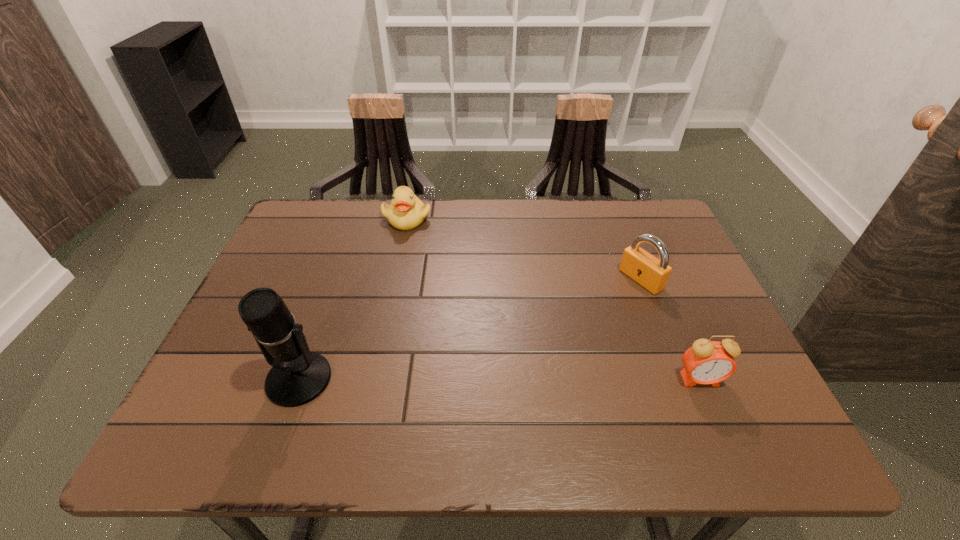
This screenshot has height=540, width=960. Find the location of `free spot that satisfies the following two spatial constraints: 1. on the front side of the padlock; 2. on the right side of the shortest object`. free spot that satisfies the following two spatial constraints: 1. on the front side of the padlock; 2. on the right side of the shortest object is located at coordinates (395, 279).